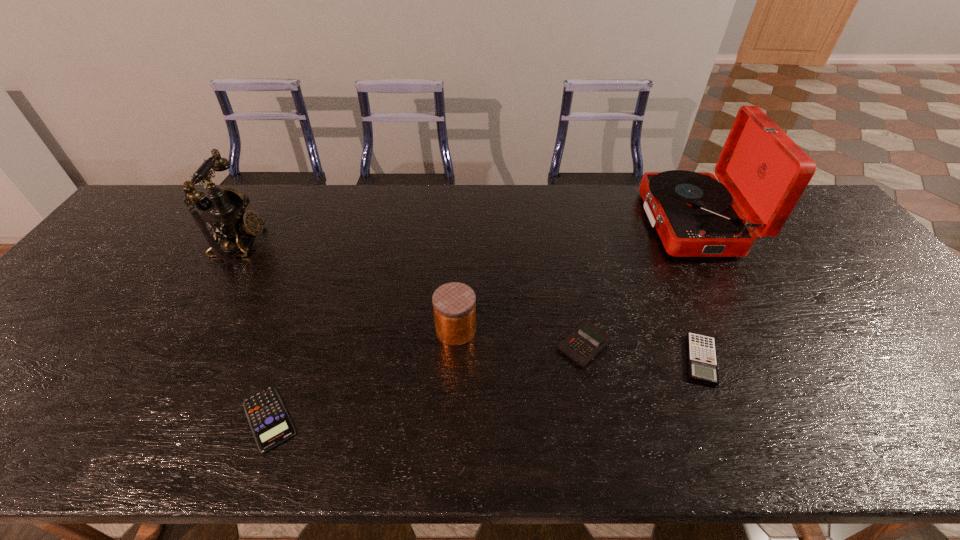
Where is `phonograph_record`? phonograph_record is located at coordinates (760, 168).

Locate an element on the screen. telephone is located at coordinates click(x=223, y=208).

This screenshot has width=960, height=540. In order to click on the leftmost object in this screenshot , I will do `click(223, 208)`.

Locate an element on the screen. the third object from left to right is located at coordinates (454, 304).

I want to click on jar, so click(x=454, y=304).

Identify the location of the tallest calculator. Image resolution: width=960 pixels, height=540 pixels. (586, 341).

What are the coordinates of `the fourth object from left to right` in the screenshot? It's located at (586, 341).

Where is `the second shortest object`? the second shortest object is located at coordinates (702, 360).

Where is `the rightmost calculator`? The height and width of the screenshot is (540, 960). the rightmost calculator is located at coordinates (702, 360).

Image resolution: width=960 pixels, height=540 pixels. In order to click on the fifth object from right to left in this screenshot , I will do `click(270, 423)`.